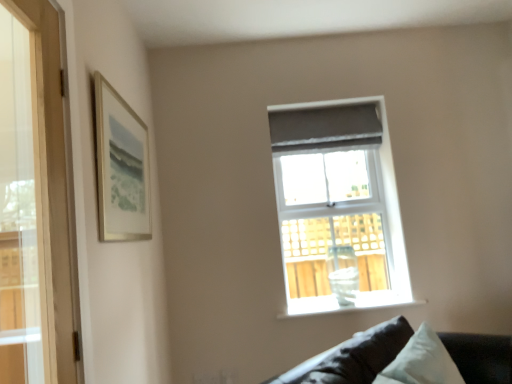
Question: Is matte gray window at upper center facing towards white glossy vase at center?

Choices:
 (A) no
 (B) yes

Answer: (A)

Question: Is there a large distance between matte gray window at upper center and white glossy vase at center?

Choices:
 (A) yes
 (B) no

Answer: (B)

Question: Considering the relative sizes of matte gray window at upper center and white glossy vase at center in the image provided, is matte gray window at upper center taller than white glossy vase at center?

Choices:
 (A) no
 (B) yes

Answer: (B)

Question: Is the depth of matte gray window at upper center greater than that of white glossy vase at center?

Choices:
 (A) yes
 (B) no

Answer: (A)

Question: Is matte gray window at upper center at the right side of white glossy vase at center?

Choices:
 (A) yes
 (B) no

Answer: (B)

Question: Is matte gray window at upper center outside of white glossy vase at center?

Choices:
 (A) no
 (B) yes

Answer: (B)

Question: Is matte gray window at upper center closer to the viewer compared to matte silver picture frame at upper left?

Choices:
 (A) yes
 (B) no

Answer: (B)

Question: Is matte gray window at upper center facing towards matte silver picture frame at upper left?

Choices:
 (A) no
 (B) yes

Answer: (A)

Question: Is matte gray window at upper center looking in the opposite direction of matte silver picture frame at upper left?

Choices:
 (A) no
 (B) yes

Answer: (A)

Question: Is matte gray window at upper center beside matte silver picture frame at upper left?

Choices:
 (A) yes
 (B) no

Answer: (B)

Question: Does matte gray window at upper center have a greater width compared to matte silver picture frame at upper left?

Choices:
 (A) yes
 (B) no

Answer: (A)

Question: Is matte silver picture frame at upper left a part of matte gray window at upper center?

Choices:
 (A) yes
 (B) no

Answer: (B)

Question: Is dark gray fabric couch at lower right taller than matte silver picture frame at upper left?

Choices:
 (A) no
 (B) yes

Answer: (A)